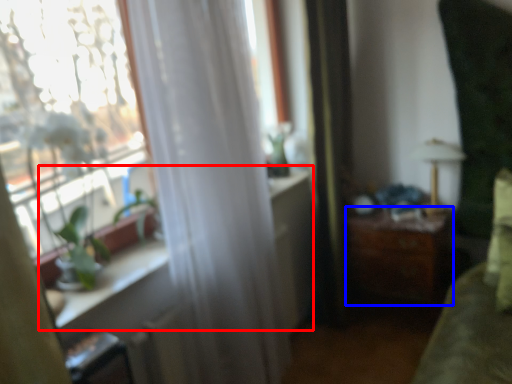
Question: Which point is further to the camera, window sill (highlighted by a red box) or table (highlighted by a blue box)?

Choices:
 (A) window sill
 (B) table

Answer: (B)